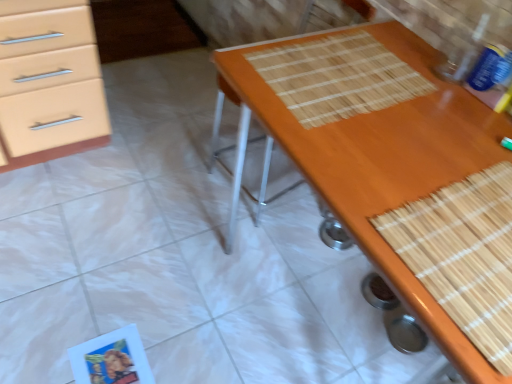
This screenshot has width=512, height=384. Describe the element at coordinates (384, 163) in the screenshot. I see `wooden desk at center` at that location.

Find the location of a particular element. This screenshot has height=384, width=512. wooden desk at center is located at coordinates (384, 163).

Locate an element on the screen. wooden desk at center is located at coordinates (384, 163).